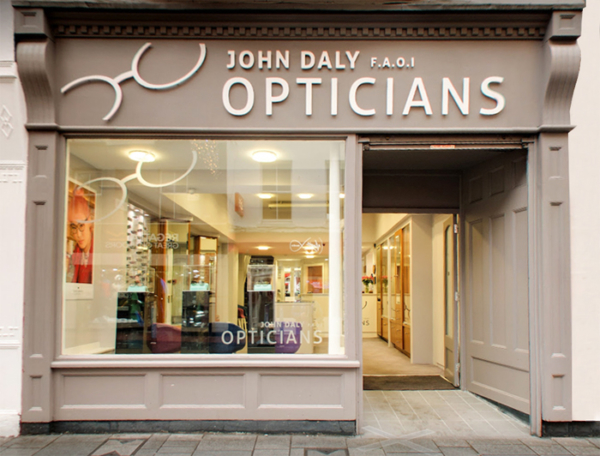
Locate an element on the screen. This screenshot has width=600, height=456. blue waiting chair is located at coordinates (222, 333), (214, 336).